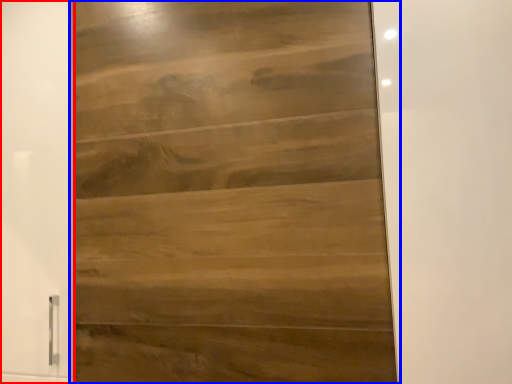
Question: Which object appears farthest to the camera in this image, barn door (highlighted by a red box) or door (highlighted by a blue box)?

Choices:
 (A) barn door
 (B) door

Answer: (A)